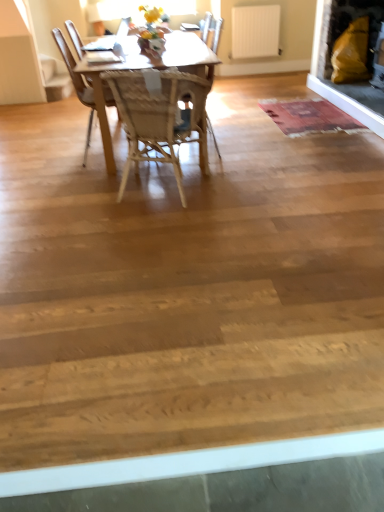
Locate an element on the screen. white matte radiator at upper center is located at coordinates (255, 31).

This screenshot has width=384, height=512. Describe the element at coordinates (348, 58) in the screenshot. I see `matte yellow cushion at upper right` at that location.

Image resolution: width=384 pixels, height=512 pixels. Identify the location of wooden chair at center, marked as the second chair in a front-to-back arrangement. (217, 35).

This screenshot has height=512, width=384. Describe the element at coordinates (160, 118) in the screenshot. I see `woven wood chair at center, the 2th chair when ordered from back to front` at that location.

This screenshot has width=384, height=512. Describe the element at coordinates (308, 117) in the screenshot. I see `rustic woolen mat at center` at that location.

What is the approximate height of rustic woolen mat at center?

2.06 inches.

The image size is (384, 512). Find the location of `white matte radiator at upper center`. white matte radiator at upper center is located at coordinates (255, 31).

From a real-world perspective, is rustic woolen mat at center physically below matte yellow cushion at upper right?

Correct, in the physical world, rustic woolen mat at center is lower than matte yellow cushion at upper right.

Is rustic woolen mat at center not within matte yellow cushion at upper right?

Yes.

Based on their sizes in the image, would you say rustic woolen mat at center is bigger or smaller than matte yellow cushion at upper right?

Clearly, rustic woolen mat at center is smaller in size than matte yellow cushion at upper right.

Considering the relative positions of rustic woolen mat at center and matte yellow cushion at upper right in the image provided, is rustic woolen mat at center to the left or to the right of matte yellow cushion at upper right?

From the image, it's evident that rustic woolen mat at center is to the left of matte yellow cushion at upper right.

Which of these two, rustic woolen mat at center or woven wood chair at center, which is the first chair from front to back, is thinner?

With smaller width is woven wood chair at center, which is the first chair from front to back.

Locate an element on the screen. Image resolution: width=384 pixels, height=512 pixels. mat below the woven wood chair at center, the 2th chair when ordered from back to front (from a real-world perspective) is located at coordinates (308, 117).

Can you tell me how much rustic woolen mat at center and woven wood chair at center, which is the first chair from front to back, differ in facing direction?

There is a 109-degree angle between the facing directions of rustic woolen mat at center and woven wood chair at center, which is the first chair from front to back.

Looking at this image, which of these two, rustic woolen mat at center or woven wood chair at center, which is the first chair from front to back, stands shorter?

rustic woolen mat at center is shorter.

From the image's perspective, is white matte radiator at upper center on top of woven wood chair at center, the 2th chair when ordered from back to front?

Yes, from the image's perspective, white matte radiator at upper center is on top of woven wood chair at center, the 2th chair when ordered from back to front.

Which object is wider, white matte radiator at upper center or woven wood chair at center, which is the first chair from front to back?

With larger width is woven wood chair at center, which is the first chair from front to back.

Between white matte radiator at upper center and woven wood chair at center, which is the first chair from front to back, which one is positioned behind?

white matte radiator at upper center is more distant.

From a real-world perspective, which is physically above, white matte radiator at upper center or woven wood chair at center, the 2th chair when ordered from back to front?

white matte radiator at upper center.

In terms of height, does matte yellow cushion at upper right look taller or shorter compared to wooden chair at center, the 1th chair viewed from the back?

Clearly, matte yellow cushion at upper right is shorter compared to wooden chair at center, the 1th chair viewed from the back.

Find the location of a particular element. fireplace on the right of wooden chair at center, the 1th chair viewed from the back is located at coordinates (348, 58).

Is point (320, 19) farther from viewer compared to point (212, 81)?

No, (320, 19) is closer to viewer.

Based on their sizes in the image, would you say matte yellow cushion at upper right is bigger or smaller than wooden chair at center, the 1th chair viewed from the back?

matte yellow cushion at upper right is bigger than wooden chair at center, the 1th chair viewed from the back.

How far apart are white matte radiator at upper center and rustic woolen mat at center?

white matte radiator at upper center is 6.64 feet from rustic woolen mat at center.

Considering the positions of objects white matte radiator at upper center and rustic woolen mat at center in the image provided, who is more to the left, white matte radiator at upper center or rustic woolen mat at center?

From the viewer's perspective, white matte radiator at upper center appears more on the left side.

Does white matte radiator at upper center have a lesser width compared to rustic woolen mat at center?

Yes.

Would you say white matte radiator at upper center contains rustic woolen mat at center?

No.

Is wooden chair at center, the 1th chair viewed from the back, oriented towards rustic woolen mat at center?

No, wooden chair at center, the 1th chair viewed from the back, does not turn towards rustic woolen mat at center.

Considering the relative sizes of wooden chair at center, the 1th chair viewed from the back, and rustic woolen mat at center in the image provided, is wooden chair at center, the 1th chair viewed from the back, bigger than rustic woolen mat at center?

Correct, wooden chair at center, the 1th chair viewed from the back, is larger in size than rustic woolen mat at center.

From a real-world perspective, is wooden chair at center, marked as the second chair in a front-to-back arrangement, physically above rustic woolen mat at center?

Yes.

Which is more to the left, wooden chair at center, marked as the second chair in a front-to-back arrangement, or rustic woolen mat at center?

wooden chair at center, marked as the second chair in a front-to-back arrangement, is more to the left.

The width and height of the screenshot is (384, 512). I want to click on radiator behind the wooden chair at center, marked as the second chair in a front-to-back arrangement, so click(x=255, y=31).

From the image's perspective, is wooden chair at center, marked as the second chair in a front-to-back arrangement, positioned above or below white matte radiator at upper center?

From the image's perspective, wooden chair at center, marked as the second chair in a front-to-back arrangement, appears below white matte radiator at upper center.

From a real-world perspective, who is located higher, wooden chair at center, marked as the second chair in a front-to-back arrangement, or white matte radiator at upper center?

In real-world perspective, white matte radiator at upper center is above.

Based on their sizes in the image, would you say wooden chair at center, marked as the second chair in a front-to-back arrangement, is bigger or smaller than white matte radiator at upper center?

Considering their sizes, wooden chair at center, marked as the second chair in a front-to-back arrangement, takes up more space than white matte radiator at upper center.

Where is `mat that appears on the left of matte yellow cushion at upper right`? The height and width of the screenshot is (512, 384). mat that appears on the left of matte yellow cushion at upper right is located at coordinates (308, 117).

Locate an element on the screen. This screenshot has width=384, height=512. chair that is the 2nd one when counting downward from the rustic woolen mat at center (from the image's perspective) is located at coordinates (160, 118).

Considering their positions, is matte yellow cushion at upper right positioned further to white matte radiator at upper center than rustic woolen mat at center?

rustic woolen mat at center.

Estimate the real-world distances between objects in this image. Which object is further from woven wood chair at center, which is the first chair from front to back, rustic woolen mat at center or wooden chair at center, the 1th chair viewed from the back?

Based on the image, wooden chair at center, the 1th chair viewed from the back, appears to be further to woven wood chair at center, which is the first chair from front to back.

Which object lies further to the anchor point matte yellow cushion at upper right, wooden chair at center, marked as the second chair in a front-to-back arrangement, or rustic woolen mat at center?

The object further to matte yellow cushion at upper right is wooden chair at center, marked as the second chair in a front-to-back arrangement.

Considering their positions, is rustic woolen mat at center positioned further to white matte radiator at upper center than wooden chair at center, marked as the second chair in a front-to-back arrangement?

rustic woolen mat at center is further to white matte radiator at upper center.

Considering their positions, is white matte radiator at upper center positioned further to wooden chair at center, the 1th chair viewed from the back, than woven wood chair at center, which is the first chair from front to back?

woven wood chair at center, which is the first chair from front to back.

When comparing their distances from rustic woolen mat at center, does woven wood chair at center, which is the first chair from front to back, or white matte radiator at upper center seem further?

white matte radiator at upper center is positioned further to the anchor rustic woolen mat at center.

Looking at the image, which one is located further to rustic woolen mat at center, wooden chair at center, marked as the second chair in a front-to-back arrangement, or matte yellow cushion at upper right?

wooden chair at center, marked as the second chair in a front-to-back arrangement, is positioned further to the anchor rustic woolen mat at center.

From the image, which object appears to be farther from rustic woolen mat at center, matte yellow cushion at upper right or white matte radiator at upper center?

The object further to rustic woolen mat at center is white matte radiator at upper center.

What are the coordinates of `mat positioned between wooden chair at center, marked as the second chair in a front-to-back arrangement, and white matte radiator at upper center from near to far` in the screenshot? It's located at (308, 117).

Identify the location of fireplace located between woven wood chair at center, the 2th chair when ordered from back to front, and white matte radiator at upper center in the depth direction. The image size is (384, 512). (348, 58).

Image resolution: width=384 pixels, height=512 pixels. I want to click on mat between wooden chair at center, the 1th chair viewed from the back, and matte yellow cushion at upper right, so click(308, 117).

At what (x,y) coordinates should I click in order to perform the action: click on chair between woven wood chair at center, which is the first chair from front to back, and rustic woolen mat at center, along the z-axis. Please return your answer as a coordinate pair (x, y). This screenshot has width=384, height=512. Looking at the image, I should click on (217, 35).